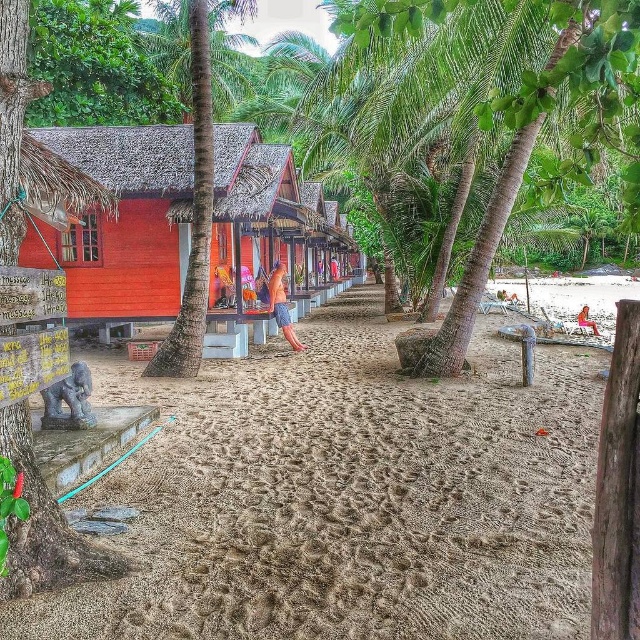
Is brown sandy beach at center to the left of matte red wooden hut at center from the viewer's perspective?

Indeed, brown sandy beach at center is positioned on the left side of matte red wooden hut at center.

Does brown sandy beach at center appear over matte red wooden hut at center?

No, brown sandy beach at center is not above matte red wooden hut at center.

This screenshot has height=640, width=640. In order to click on brown sandy beach at center in this screenshot , I will do `click(349, 497)`.

Can you confirm if matte red wooden hut at center is positioned below orange fabric towel at center?

Actually, matte red wooden hut at center is above orange fabric towel at center.

Who is more distant from viewer, (116, 260) or (580, 324)?

Point (580, 324)

At what (x,y) coordinates should I click in order to perform the action: click on matte red wooden hut at center. Please return your answer as a coordinate pair (x, y). Looking at the image, I should click on (124, 221).

Who is positioned more to the right, brown sandy beach at center or green leafy palm tree at center?

Positioned to the right is brown sandy beach at center.

Between brown sandy beach at center and green leafy palm tree at center, which one has more height?

Standing taller between the two is green leafy palm tree at center.

Between point (150, 474) and point (209, 161), which one is positioned in front?

Point (150, 474) is more forward.

Locate an element on the screen. This screenshot has width=640, height=640. brown sandy beach at center is located at coordinates (349, 497).